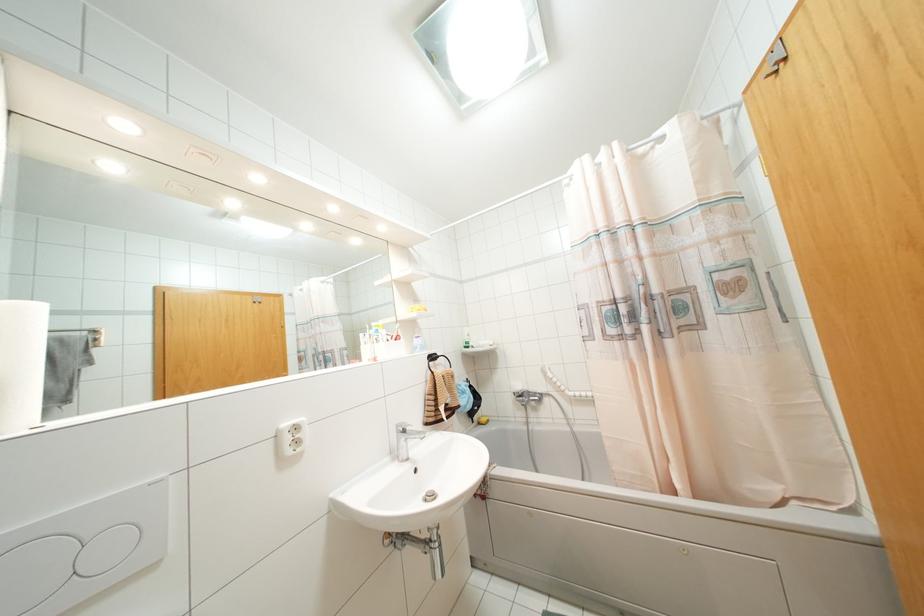
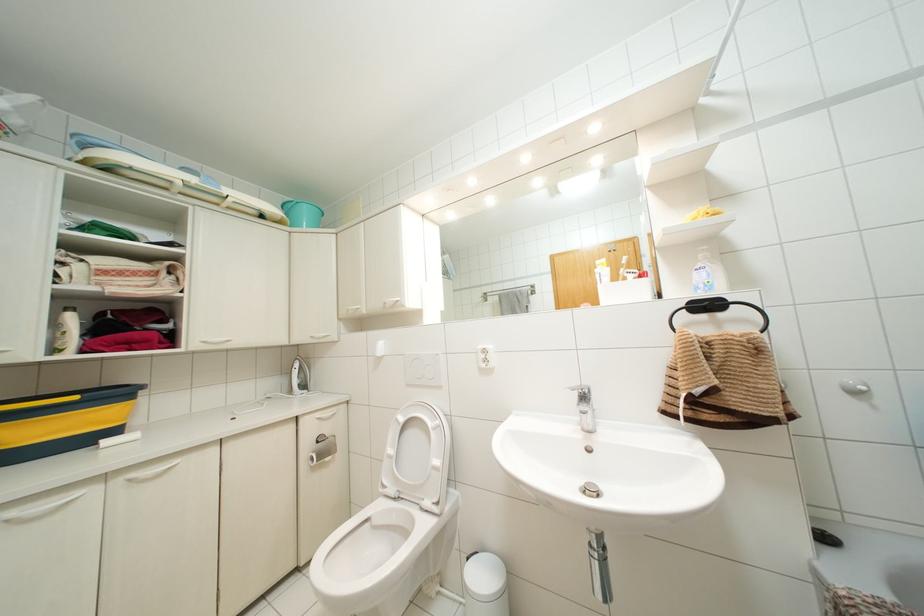
Where in the second image is the point corresponding to point (404, 431) from the first image?

(584, 395)